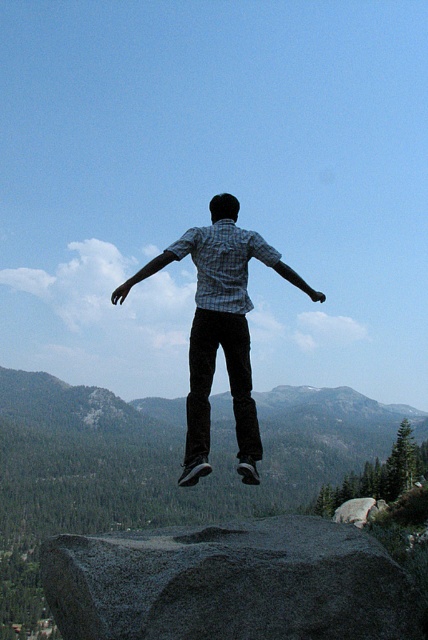
Question: In this image, where is gray rough rock at center located relative to checkered shirt at center?

Choices:
 (A) below
 (B) above

Answer: (A)

Question: Does gray rough rock at center have a greater width compared to checkered shirt at center?

Choices:
 (A) no
 (B) yes

Answer: (A)

Question: Which of the following is the closest to the observer?

Choices:
 (A) [x=353, y=589]
 (B) [x=208, y=342]

Answer: (A)

Question: Is gray rough rock at center to the right of checkered shirt at center from the viewer's perspective?

Choices:
 (A) no
 (B) yes

Answer: (A)